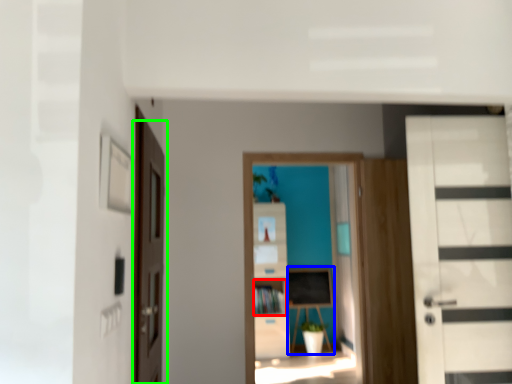
Question: Which object is the farthest from cabinet (highlighted by a red box)? Choose among these: table (highlighted by a blue box) or door (highlighted by a green box).

Choices:
 (A) table
 (B) door

Answer: (B)